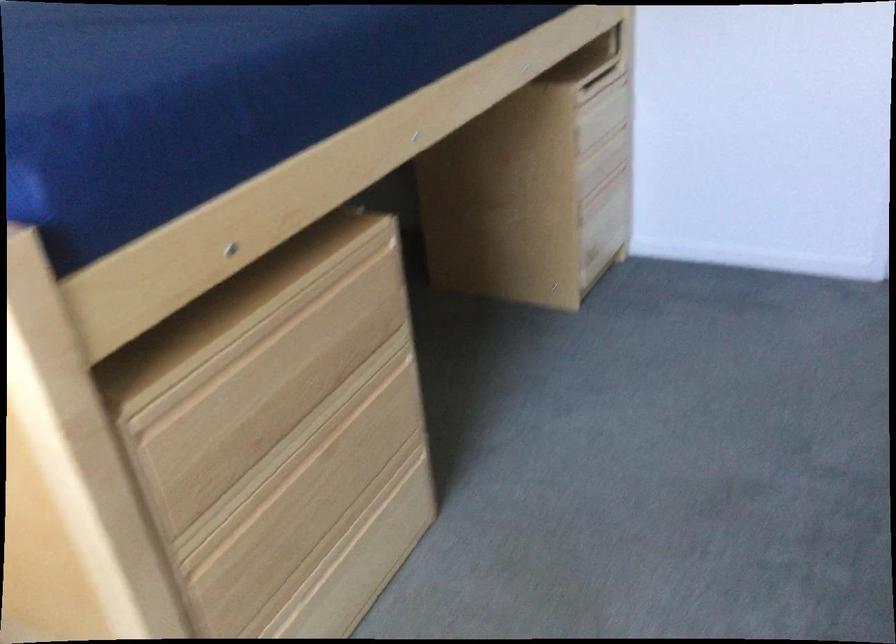
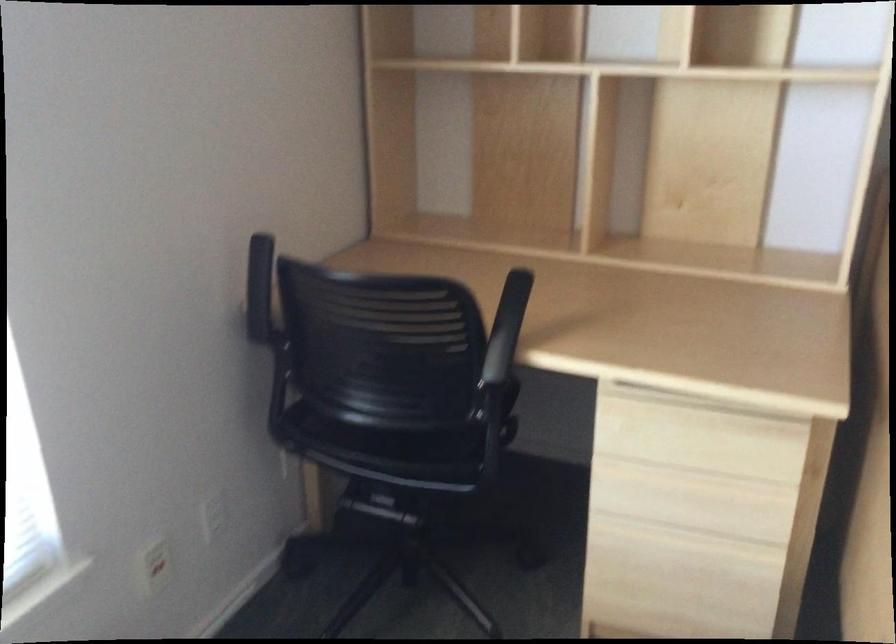
Consider the image. The images are taken continuously from a first-person perspective. In which direction is your viewpoint rotating?

The camera rotated toward left-down.